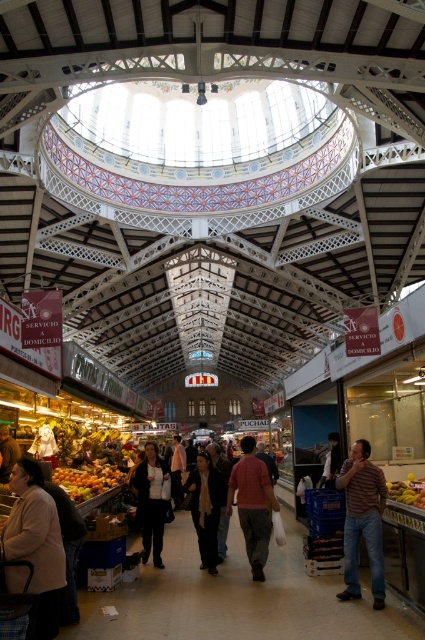
Question: Which is nearer to the matte pink shirt at center?

Choices:
 (A) yellow matte bananas at lower right
 (B) matte plastic crate at center
 (C) dark gray suit at center

Answer: (C)

Question: Is matte plastic crate at center below yellow matte oranges at lower left?

Choices:
 (A) yes
 (B) no

Answer: (A)

Question: Which point is farther to the camera?

Choices:
 (A) striped shirt at lower right
 (B) beige wool coat at lower left
 (C) matte black jacket at center

Answer: (C)

Question: Is yellow matte oranges at lower left positioned before dark gray sweater at center?

Choices:
 (A) no
 (B) yes

Answer: (B)

Question: Is matte pink shirt at center smaller than yellow matte oranges at lower left?

Choices:
 (A) yes
 (B) no

Answer: (A)

Question: Which point is closer to the camera?

Choices:
 (A) (172, 468)
 (B) (197, 524)

Answer: (B)